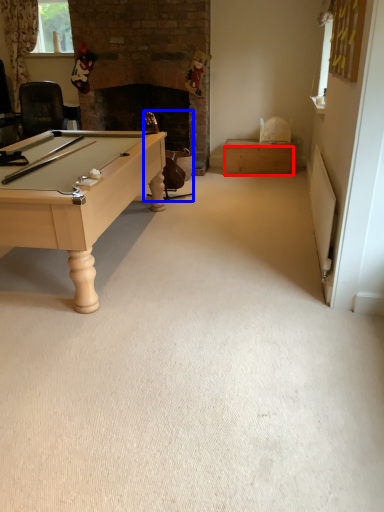
Question: Which object is closer to the camera taking this photo, drawer (highlighted by a red box) or swivel chair (highlighted by a blue box)?

Choices:
 (A) drawer
 (B) swivel chair

Answer: (B)